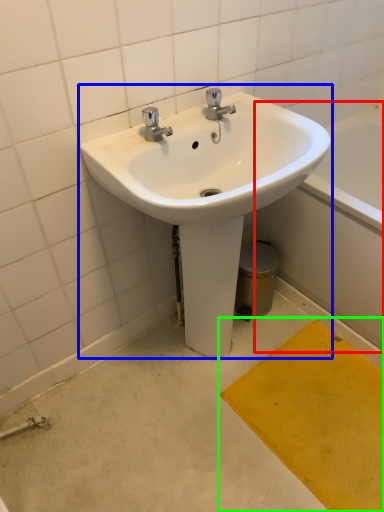
Question: Estimate the real-world distances between objects in this image. Which object is farther from bath (highlighted by a red box), sink (highlighted by a blue box) or doormat (highlighted by a green box)?

Choices:
 (A) sink
 (B) doormat

Answer: (A)